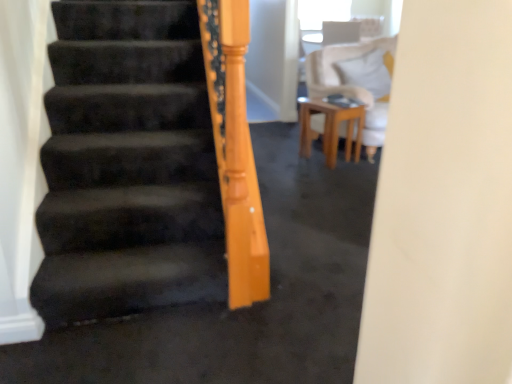
Question: Which is correct: white soft pillow at upper right is inside transparent plastic window screen at upper center, or outside of it?

Choices:
 (A) outside
 (B) inside

Answer: (A)

Question: Is white soft pillow at upper right in front of or behind transparent plastic window screen at upper center in the image?

Choices:
 (A) behind
 (B) front

Answer: (B)

Question: Which is nearer to the transparent plastic window screen at upper center?

Choices:
 (A) wooden table at center
 (B) white soft pillow at upper right

Answer: (B)

Question: Which object is the closest to the transparent plastic window screen at upper center?

Choices:
 (A) white soft pillow at upper right
 (B) wooden table at center

Answer: (A)